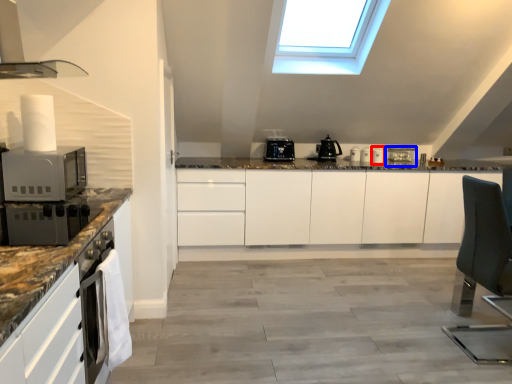
Question: Which point is closer to the camera, appliance (highlighted by a red box) or appliance (highlighted by a blue box)?

Choices:
 (A) appliance
 (B) appliance

Answer: (A)